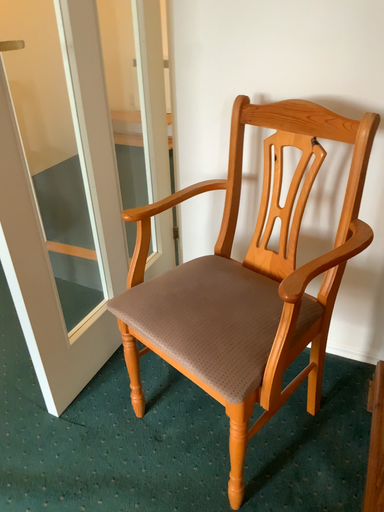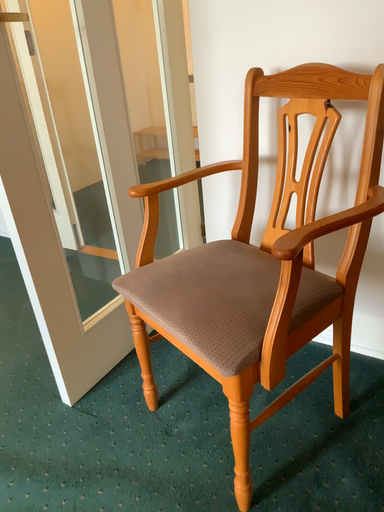
Question: Which way did the camera rotate in the video?

Choices:
 (A) rotated right
 (B) rotated left

Answer: (B)